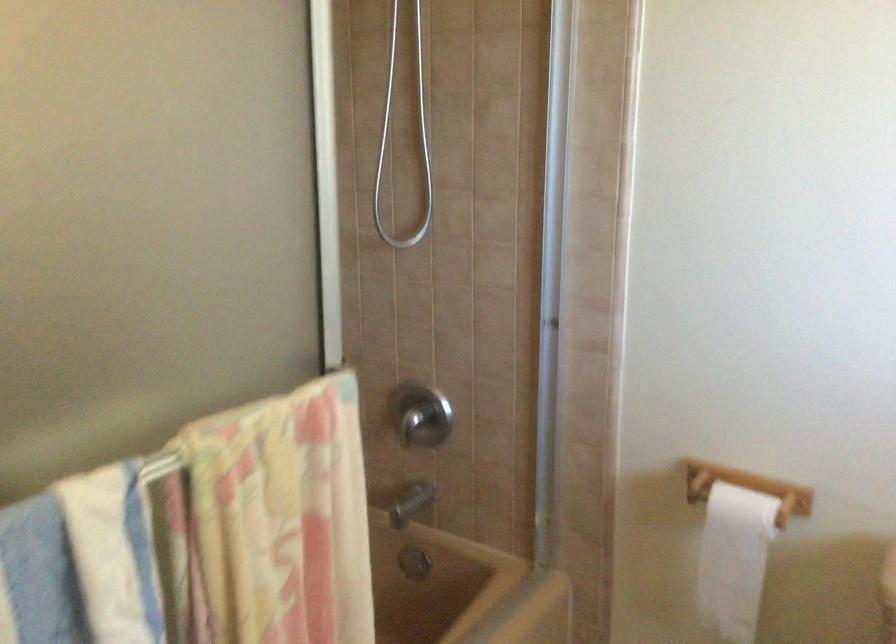
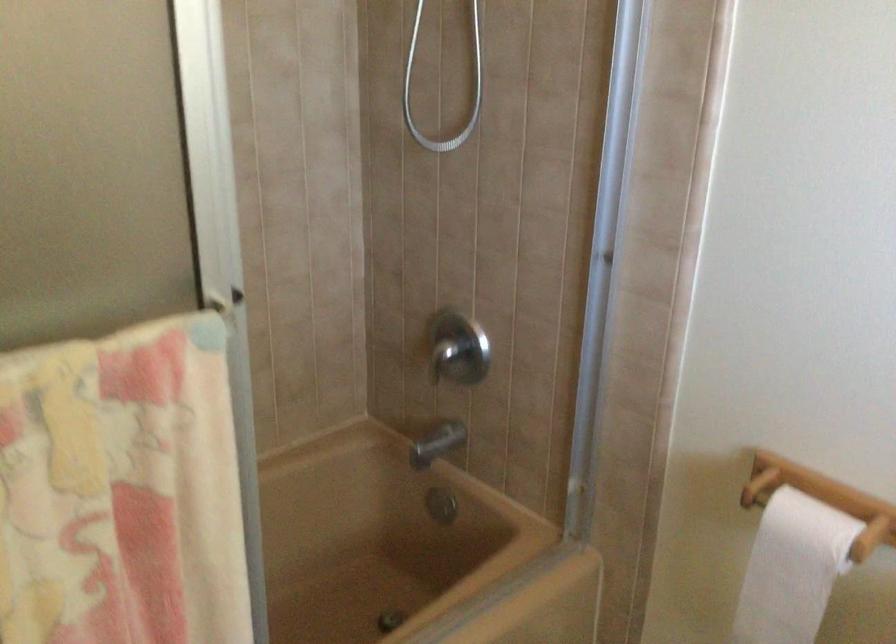
Locate, in the second image, the point that corresponds to (x=400, y=202) in the first image.

(444, 86)